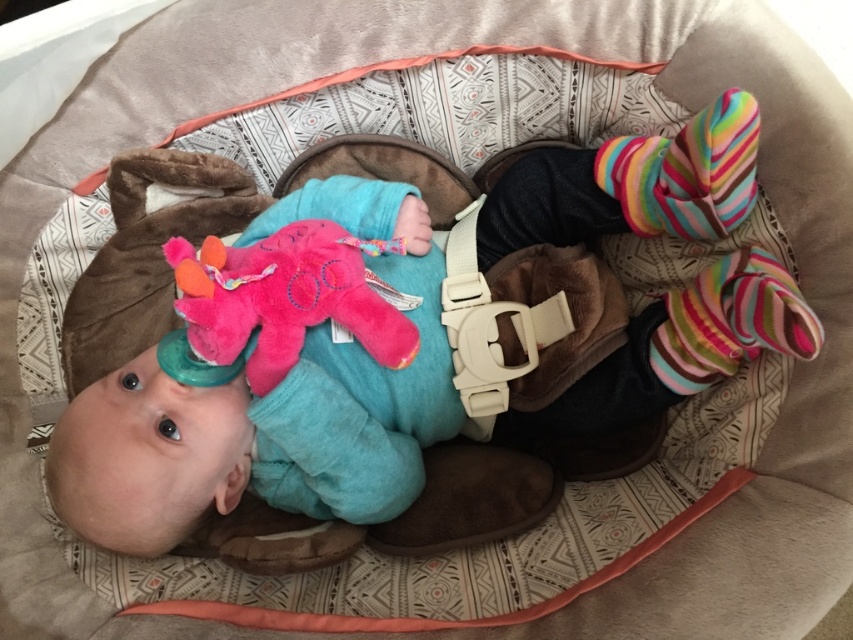
Question: Is pink plush toy at center smaller than multicolored striped sock at right?

Choices:
 (A) no
 (B) yes

Answer: (A)

Question: Is pink plush toy at center positioned at the back of multicolored fuzzy socks at upper right?

Choices:
 (A) no
 (B) yes

Answer: (B)

Question: Among these points, which one is farthest from the camera?

Choices:
 (A) (643, 147)
 (B) (744, 355)
 (C) (216, 282)

Answer: (A)

Question: Can you confirm if pink plush toy at center is positioned below multicolored striped sock at right?

Choices:
 (A) no
 (B) yes

Answer: (A)

Question: Which object is the closest to the multicolored fuzzy socks at upper right?

Choices:
 (A) pink plush toy at center
 (B) multicolored striped sock at right

Answer: (B)

Question: Which of these objects is positioned farthest from the pink plush toy at center?

Choices:
 (A) multicolored fuzzy socks at upper right
 (B) multicolored striped sock at right

Answer: (B)